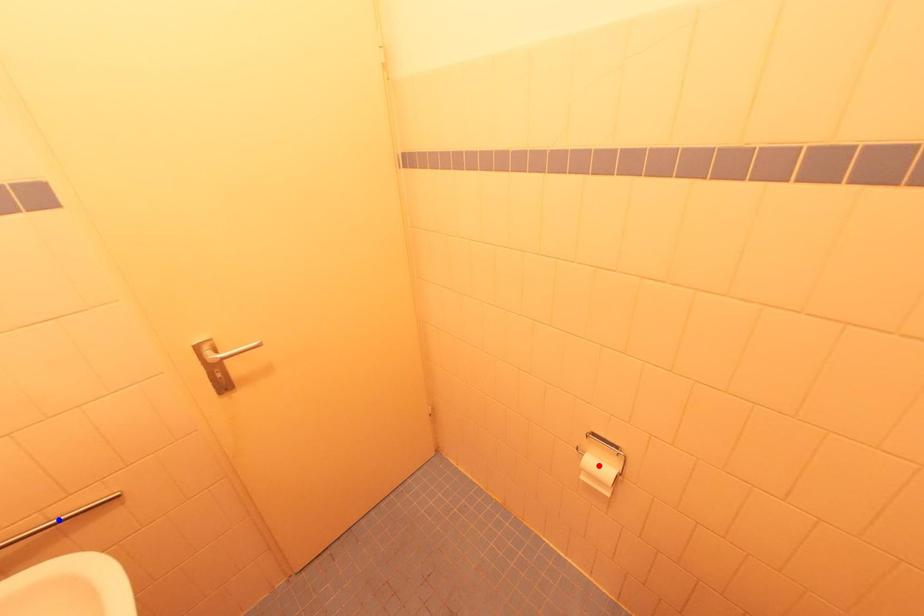
Question: Two points are marked on the image. Which point is closer to the camera?

Choices:
 (A) Blue point is closer.
 (B) Red point is closer.

Answer: (A)